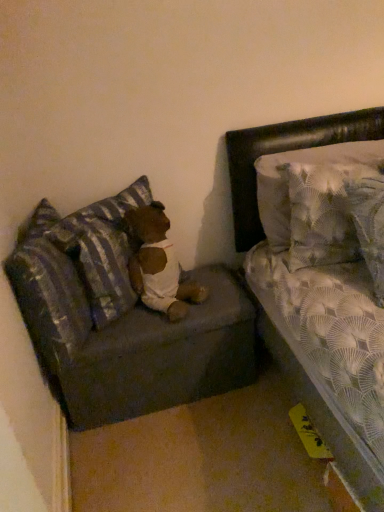
Question: Is dark gray fabric couch at lower left bigger than striped fabric pillow at left, which appears as the second pillow when viewed from the left?

Choices:
 (A) no
 (B) yes

Answer: (B)

Question: Is dark gray fabric couch at lower left located outside striped fabric pillow at left, which appears as the second pillow when viewed from the right?

Choices:
 (A) no
 (B) yes

Answer: (B)

Question: Could you tell me if dark gray fabric couch at lower left is turned towards striped fabric pillow at left, which appears as the second pillow when viewed from the right?

Choices:
 (A) yes
 (B) no

Answer: (B)

Question: From a real-world perspective, is dark gray fabric couch at lower left on top of striped fabric pillow at left, which appears as the second pillow when viewed from the left?

Choices:
 (A) yes
 (B) no

Answer: (B)

Question: Does dark gray fabric couch at lower left have a greater width compared to striped fabric pillow at left, which appears as the second pillow when viewed from the right?

Choices:
 (A) no
 (B) yes

Answer: (B)

Question: Is dark gray fabric couch at lower left not close to striped fabric pillow at left, which appears as the second pillow when viewed from the left?

Choices:
 (A) no
 (B) yes

Answer: (A)

Question: Would you say striped fabric pillow at left, positioned as the first pillow in left-to-right order, is outside striped fabric pillow at left, which appears as the second pillow when viewed from the right?

Choices:
 (A) yes
 (B) no

Answer: (A)

Question: Is striped fabric pillow at left, positioned as the first pillow in left-to-right order, thinner than striped fabric pillow at left, which appears as the second pillow when viewed from the right?

Choices:
 (A) no
 (B) yes

Answer: (A)

Question: Is striped fabric pillow at left, which appears as the 3th pillow when viewed from the right, not near striped fabric pillow at left, which appears as the second pillow when viewed from the right?

Choices:
 (A) no
 (B) yes

Answer: (A)

Question: Considering the relative sizes of striped fabric pillow at left, which appears as the 3th pillow when viewed from the right, and striped fabric pillow at left, which appears as the second pillow when viewed from the right, in the image provided, is striped fabric pillow at left, which appears as the 3th pillow when viewed from the right, shorter than striped fabric pillow at left, which appears as the second pillow when viewed from the right,?

Choices:
 (A) no
 (B) yes

Answer: (B)

Question: Does striped fabric pillow at left, which appears as the 3th pillow when viewed from the right, have a greater height compared to striped fabric pillow at left, which appears as the second pillow when viewed from the right?

Choices:
 (A) yes
 (B) no

Answer: (B)

Question: From a real-world perspective, is striped fabric pillow at left, which appears as the 3th pillow when viewed from the right, on top of striped fabric pillow at left, which appears as the second pillow when viewed from the left?

Choices:
 (A) no
 (B) yes

Answer: (A)

Question: Is striped fabric pillow at left, which appears as the second pillow when viewed from the right, wider than striped fabric pillow at left, which appears as the 3th pillow when viewed from the right?

Choices:
 (A) yes
 (B) no

Answer: (B)